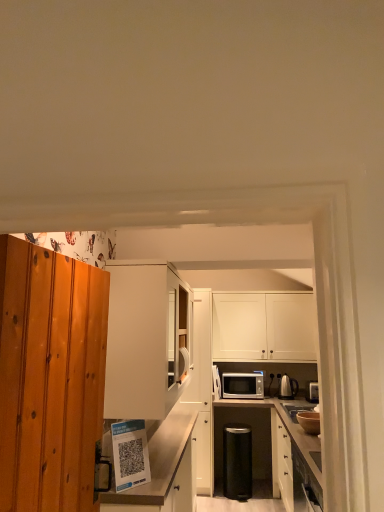
The height and width of the screenshot is (512, 384). What do you see at coordinates (288, 387) in the screenshot? I see `satin silver kettle at right, which is the 3th appliance in front-to-back order` at bounding box center [288, 387].

This screenshot has width=384, height=512. What do you see at coordinates (242, 386) in the screenshot?
I see `silver metallic microwave at center` at bounding box center [242, 386].

What do you see at coordinates (264, 327) in the screenshot?
I see `white matte cabinet at upper center, which is counted as the 4th cabinetry, starting from the left` at bounding box center [264, 327].

What do you see at coordinates (142, 342) in the screenshot? The image size is (384, 512). I see `white matte cabinet at center, which is the 4th cabinetry in right-to-left order` at bounding box center [142, 342].

In order to click on black plastic trash can at center, placed as the 2th appliance when sorted from back to front in this screenshot , I will do `click(237, 462)`.

Find the location of `satin silver kettle at right, the 2th appliance when ordered from bottom to top`. satin silver kettle at right, the 2th appliance when ordered from bottom to top is located at coordinates (288, 387).

Is matte white shelf at lower center, which is the third cabinetry from right to left, in front of or behind satin silver kettle at right, which is the third appliance from left to right, in the image?

Visually, matte white shelf at lower center, which is the third cabinetry from right to left, is located in front of satin silver kettle at right, which is the third appliance from left to right.

From a real-world perspective, is matte white shelf at lower center, which is the third cabinetry from right to left, positioned under satin silver kettle at right, which ranks as the second appliance in top-to-bottom order, based on gravity?

Correct, in the physical world, matte white shelf at lower center, which is the third cabinetry from right to left, is lower than satin silver kettle at right, which ranks as the second appliance in top-to-bottom order.

Would you say matte white shelf at lower center, which is the third cabinetry from right to left, is inside or outside satin silver kettle at right, which is the third appliance from left to right?

matte white shelf at lower center, which is the third cabinetry from right to left, is spatially situated outside satin silver kettle at right, which is the third appliance from left to right.

In terms of size, does matte white shelf at lower center, the 2th cabinetry positioned from the left, appear bigger or smaller than satin silver kettle at right, the 2th appliance when ordered from bottom to top?

Considering their sizes, matte white shelf at lower center, the 2th cabinetry positioned from the left, takes up more space than satin silver kettle at right, the 2th appliance when ordered from bottom to top.

In order to click on appliance on the left of matte brown bowl at lower right, the second appliance viewed from the left in this screenshot , I will do `click(237, 462)`.

Is matte brown bowl at lower right, the first appliance viewed from the top, aimed at black plastic trash can at center, positioned as the second appliance in front-to-back order?

No, matte brown bowl at lower right, the first appliance viewed from the top, is not oriented towards black plastic trash can at center, positioned as the second appliance in front-to-back order.

Considering the relative positions of matte brown bowl at lower right, the first appliance viewed from the top, and black plastic trash can at center, positioned as the second appliance in front-to-back order, in the image provided, is matte brown bowl at lower right, the first appliance viewed from the top, to the left of black plastic trash can at center, positioned as the second appliance in front-to-back order, from the viewer's perspective?

No.

Which point is more forward, (x=312, y=412) or (x=241, y=465)?

The point (x=312, y=412) is more forward.

The height and width of the screenshot is (512, 384). Find the location of `the 2nd cabinetry behind the black plastic trash can at center, placed as the 2th appliance when sorted from back to front, starting your count from the anchor`. the 2nd cabinetry behind the black plastic trash can at center, placed as the 2th appliance when sorted from back to front, starting your count from the anchor is located at coordinates (264, 327).

Which of these two, black plastic trash can at center, marked as the third appliance in a top-to-bottom arrangement, or white matte cabinet at upper center, which is counted as the 4th cabinetry, starting from the left, is wider?

black plastic trash can at center, marked as the third appliance in a top-to-bottom arrangement.

From the image's perspective, which one is positioned higher, black plastic trash can at center, placed as the 2th appliance when sorted from back to front, or white matte cabinet at upper center, which is counted as the 4th cabinetry, starting from the left?

From the image's view, white matte cabinet at upper center, which is counted as the 4th cabinetry, starting from the left, is above.

From a real-world perspective, is matte brown bowl at lower right, positioned as the 3th appliance in back-to-front order, above or below silver metallic microwave at center?

matte brown bowl at lower right, positioned as the 3th appliance in back-to-front order, is below silver metallic microwave at center.

Is matte brown bowl at lower right, which is counted as the second appliance, starting from the right, next to silver metallic microwave at center?

No, matte brown bowl at lower right, which is counted as the second appliance, starting from the right, is not in contact with silver metallic microwave at center.

Identify the location of microwave oven lying on the left of matte brown bowl at lower right, the second appliance viewed from the left. Image resolution: width=384 pixels, height=512 pixels. (242, 386).

Can silver metallic microwave at center be found inside matte brown bowl at lower right, the first appliance viewed from the top?

No, matte brown bowl at lower right, the first appliance viewed from the top, does not contain silver metallic microwave at center.

Which of these two, white matte cabinet at center, placed as the first cabinetry when sorted from left to right, or silver metallic microwave at center, stands shorter?

With less height is silver metallic microwave at center.

Is white matte cabinet at center, placed as the first cabinetry when sorted from left to right, positioned with its back to silver metallic microwave at center?

white matte cabinet at center, placed as the first cabinetry when sorted from left to right, does not have its back to silver metallic microwave at center.

Would you say white matte cabinet at center, which is the 4th cabinetry in right-to-left order, is inside or outside silver metallic microwave at center?

white matte cabinet at center, which is the 4th cabinetry in right-to-left order, is outside silver metallic microwave at center.

In terms of height, does white matte cabinet at upper center, which is counted as the 4th cabinetry, starting from the left, look taller or shorter compared to matte white shelf at lower center, the 2th cabinetry positioned from the left?

Clearly, white matte cabinet at upper center, which is counted as the 4th cabinetry, starting from the left, is shorter compared to matte white shelf at lower center, the 2th cabinetry positioned from the left.

Is white matte cabinet at upper center, which is counted as the 4th cabinetry, starting from the left, to the left of matte white shelf at lower center, the 2th cabinetry positioned from the left, from the viewer's perspective?

No, white matte cabinet at upper center, which is counted as the 4th cabinetry, starting from the left, is not to the left of matte white shelf at lower center, the 2th cabinetry positioned from the left.

Considering the relative sizes of white matte cabinet at upper center, marked as the first cabinetry in a right-to-left arrangement, and matte white shelf at lower center, the 2th cabinetry positioned from the left, in the image provided, is white matte cabinet at upper center, marked as the first cabinetry in a right-to-left arrangement, thinner than matte white shelf at lower center, the 2th cabinetry positioned from the left,?

Indeed, white matte cabinet at upper center, marked as the first cabinetry in a right-to-left arrangement, has a lesser width compared to matte white shelf at lower center, the 2th cabinetry positioned from the left.

How much distance is there between white matte cabinet at upper center, which is counted as the 4th cabinetry, starting from the left, and matte white shelf at lower center, which is the third cabinetry from right to left?

A distance of 1.42 meters exists between white matte cabinet at upper center, which is counted as the 4th cabinetry, starting from the left, and matte white shelf at lower center, which is the third cabinetry from right to left.

Which of these two, white matte cabinet at center, which is the 4th cabinetry in right-to-left order, or matte white shelf at lower center, the 2th cabinetry positioned from the left, stands shorter?

With less height is white matte cabinet at center, which is the 4th cabinetry in right-to-left order.

From the picture: Is white matte cabinet at center, which is the 4th cabinetry in right-to-left order, not close to matte white shelf at lower center, the 2th cabinetry positioned from the left?

That's not correct — white matte cabinet at center, which is the 4th cabinetry in right-to-left order, is a little close to matte white shelf at lower center, the 2th cabinetry positioned from the left.

This screenshot has height=512, width=384. Identify the location of cabinetry to the left of matte white shelf at lower center, which is the third cabinetry from right to left. (142, 342).

From a real-world perspective, is white matte cabinet at center, which is the 4th cabinetry in right-to-left order, positioned over matte white shelf at lower center, the 2th cabinetry positioned from the left, based on gravity?

Yes, from a real-world perspective, white matte cabinet at center, which is the 4th cabinetry in right-to-left order, is on top of matte white shelf at lower center, the 2th cabinetry positioned from the left.

Where is `the 3rd cabinetry to the left of the satin silver kettle at right, the 2th appliance when ordered from bottom to top, counting from the anchor's position`? This screenshot has width=384, height=512. the 3rd cabinetry to the left of the satin silver kettle at right, the 2th appliance when ordered from bottom to top, counting from the anchor's position is located at coordinates (163, 470).

There is a black plastic trash can at center, the first appliance in the bottom-to-top sequence. Where is `the 1st appliance above it (from a real-world perspective)`? Image resolution: width=384 pixels, height=512 pixels. the 1st appliance above it (from a real-world perspective) is located at coordinates (309, 421).

From the image, which object appears to be farther from matte brown bowl at lower right, which is the 3th appliance from bottom to top, white matte cabinet at center, placed as the 2th cabinetry when sorted from right to left, or black plastic trash can at center, the first appliance in the bottom-to-top sequence?

Based on the image, white matte cabinet at center, placed as the 2th cabinetry when sorted from right to left, appears to be further to matte brown bowl at lower right, which is the 3th appliance from bottom to top.

Estimate the real-world distances between objects in this image. Which object is further from white matte cabinet at upper center, marked as the first cabinetry in a right-to-left arrangement, white matte cabinet at center, placed as the first cabinetry when sorted from left to right, or silver metallic microwave at center?

Based on the image, white matte cabinet at center, placed as the first cabinetry when sorted from left to right, appears to be further to white matte cabinet at upper center, marked as the first cabinetry in a right-to-left arrangement.

When comparing their distances from matte brown bowl at lower right, the second appliance viewed from the left, does white matte cabinet at upper center, which is counted as the 4th cabinetry, starting from the left, or satin silver kettle at right, arranged as the first appliance when viewed from the right, seem further?

Based on the image, white matte cabinet at upper center, which is counted as the 4th cabinetry, starting from the left, appears to be further to matte brown bowl at lower right, the second appliance viewed from the left.

Looking at the image, which one is located further to satin silver kettle at right, which is the third appliance from left to right, white matte cabinet at upper center, marked as the first cabinetry in a right-to-left arrangement, or white matte cabinet at center, which is the 4th cabinetry in right-to-left order?

Based on the image, white matte cabinet at center, which is the 4th cabinetry in right-to-left order, appears to be further to satin silver kettle at right, which is the third appliance from left to right.

Based on their spatial positions, is silver metallic microwave at center or matte white shelf at lower center, the 2th cabinetry positioned from the left, further from satin silver kettle at right, which is the 3th appliance in front-to-back order?

matte white shelf at lower center, the 2th cabinetry positioned from the left, is positioned further to the anchor satin silver kettle at right, which is the 3th appliance in front-to-back order.

Looking at the image, which one is located closer to silver metallic microwave at center, black plastic trash can at center, positioned as the second appliance in front-to-back order, or white matte cabinet at center, which is the 4th cabinetry in right-to-left order?

Based on the image, black plastic trash can at center, positioned as the second appliance in front-to-back order, appears to be nearer to silver metallic microwave at center.

Which object lies further to the anchor point white matte cabinet at center, placed as the 2th cabinetry when sorted from right to left, white matte cabinet at upper center, which is counted as the 4th cabinetry, starting from the left, or white matte cabinet at center, placed as the first cabinetry when sorted from left to right?

white matte cabinet at center, placed as the first cabinetry when sorted from left to right.

Which object lies further to the anchor point silver metallic microwave at center, matte brown bowl at lower right, which is counted as the second appliance, starting from the right, or white matte cabinet at upper center, which is counted as the 4th cabinetry, starting from the left?

Among the two, matte brown bowl at lower right, which is counted as the second appliance, starting from the right, is located further to silver metallic microwave at center.

What are the coordinates of `cabinetry between matte brown bowl at lower right, positioned as the 3th appliance in back-to-front order, and satin silver kettle at right, which is the 3th appliance in front-to-back order, from front to back` in the screenshot? It's located at (201, 387).

At what (x,y) coordinates should I click in order to perform the action: click on appliance between matte brown bowl at lower right, the second appliance viewed from the left, and silver metallic microwave at center, along the z-axis. Please return your answer as a coordinate pair (x, y). The height and width of the screenshot is (512, 384). Looking at the image, I should click on (237, 462).

This screenshot has height=512, width=384. In order to click on microwave oven between matte brown bowl at lower right, which is the 3th appliance from bottom to top, and satin silver kettle at right, arranged as the first appliance when viewed from the right, along the z-axis in this screenshot , I will do `click(242, 386)`.

Where is `cabinetry between matte white shelf at lower center, which is the third cabinetry from right to left, and white matte cabinet at center, placed as the 2th cabinetry when sorted from right to left, in the front-back direction`? cabinetry between matte white shelf at lower center, which is the third cabinetry from right to left, and white matte cabinet at center, placed as the 2th cabinetry when sorted from right to left, in the front-back direction is located at coordinates (142, 342).